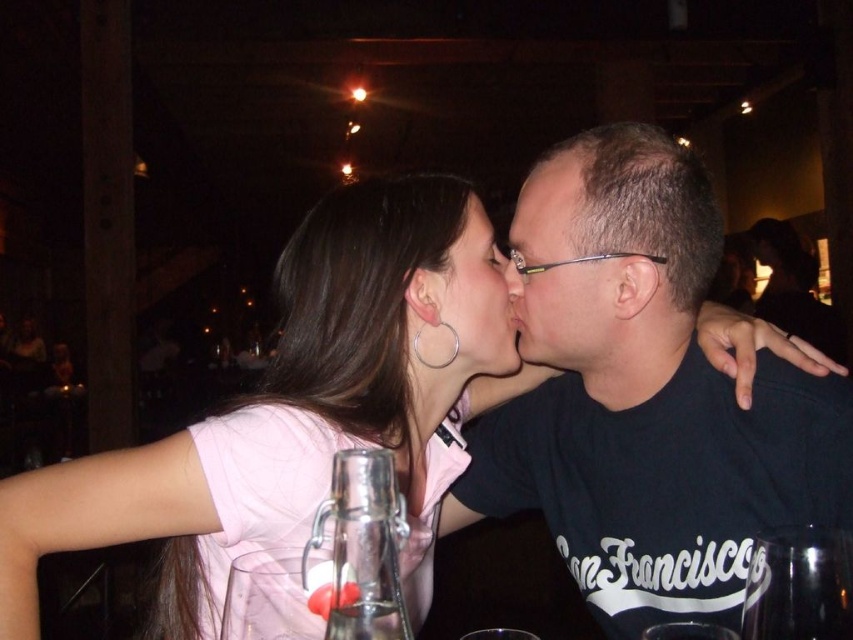
Question: Can you confirm if transparent glass at center is positioned above matte black face at center?

Choices:
 (A) no
 (B) yes

Answer: (A)

Question: Which of the following is the closest to the observer?

Choices:
 (A) transparent glass at center
 (B) matte black face at center
 (C) pink fabric shirt at center
 (D) matte black glasses at center

Answer: (A)

Question: Does black matte shirt at center appear under matte black face at center?

Choices:
 (A) no
 (B) yes

Answer: (B)

Question: Which object is positioned closest to the black matte shirt at center?

Choices:
 (A) matte black nose at center
 (B) matte black face at center
 (C) transparent glass at center

Answer: (B)

Question: Is pink fabric shirt at center thinner than transparent glass at center?

Choices:
 (A) no
 (B) yes

Answer: (A)

Question: Which point is farther to the camera?

Choices:
 (A) matte black nose at center
 (B) matte black face at center
 (C) pink fabric shirt at center
 (D) black matte shirt at center

Answer: (A)